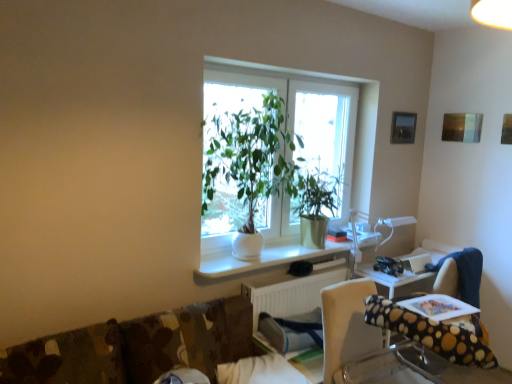
Question: Is white glossy computer desk at center in front of or behind polka dot fabric chair at lower right in the image?

Choices:
 (A) front
 (B) behind

Answer: (B)

Question: From the image's perspective, is white glossy computer desk at center located above or below polka dot fabric chair at lower right?

Choices:
 (A) below
 (B) above

Answer: (B)

Question: Considering the real-world distances, which object is closest to the white ceramic plant at center?

Choices:
 (A) polka dot fabric chair at lower right
 (B) white plastic radiator at lower center
 (C) green matte plant at center
 (D) metallic silver picture frame at upper right
 (E) white glossy computer desk at center

Answer: (C)

Question: Considering the real-world distances, which object is closest to the metallic silver picture frame at upper right?

Choices:
 (A) white plastic radiator at lower center
 (B) white ceramic plant at center
 (C) white glossy computer desk at center
 (D) polka dot fabric chair at lower right
 (E) green matte plant at center

Answer: (E)